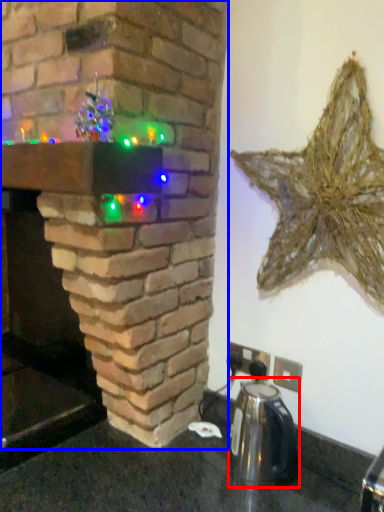
Question: Which of the following is the closest to the observer, appliance (highlighted by a red box) or fireplace (highlighted by a blue box)?

Choices:
 (A) appliance
 (B) fireplace

Answer: (B)